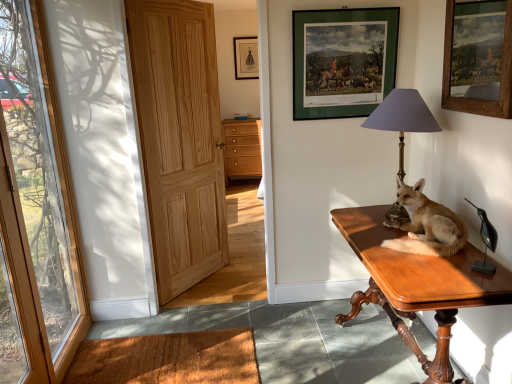
Image resolution: width=512 pixels, height=384 pixels. I want to click on vacant area on top of shiny brown wooden desk at right (from a real-world perspective), so click(413, 246).